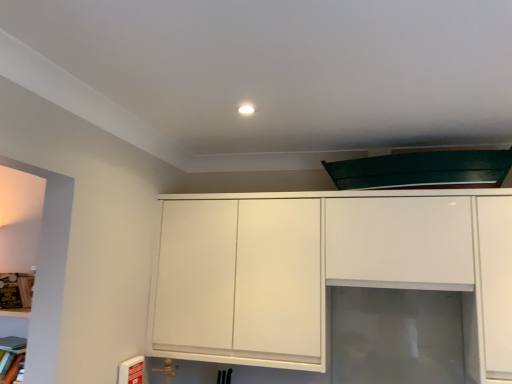
Question: Is transparent glass door at center turned away from white glossy cabinet at center?

Choices:
 (A) yes
 (B) no

Answer: (B)

Question: Can you confirm if transparent glass door at center is wider than white glossy cabinet at center?

Choices:
 (A) yes
 (B) no

Answer: (B)

Question: Is transparent glass door at center to the right of white glossy cabinet at center from the viewer's perspective?

Choices:
 (A) yes
 (B) no

Answer: (A)

Question: Is transparent glass door at center directly adjacent to white glossy cabinet at center?

Choices:
 (A) yes
 (B) no

Answer: (B)

Question: Are transparent glass door at center and white glossy cabinet at center far apart?

Choices:
 (A) no
 (B) yes

Answer: (A)

Question: Can we say transparent glass door at center lies outside white glossy cabinet at center?

Choices:
 (A) no
 (B) yes

Answer: (B)

Question: From a real-world perspective, is wooden bookshelf at left below white glossy cabinet at center?

Choices:
 (A) no
 (B) yes

Answer: (B)

Question: Does wooden bookshelf at left have a greater width compared to white glossy cabinet at center?

Choices:
 (A) yes
 (B) no

Answer: (B)

Question: Is wooden bookshelf at left oriented away from white glossy cabinet at center?

Choices:
 (A) yes
 (B) no

Answer: (B)

Question: Does wooden bookshelf at left have a lesser height compared to white glossy cabinet at center?

Choices:
 (A) yes
 (B) no

Answer: (A)

Question: Does wooden bookshelf at left have a smaller size compared to white glossy cabinet at center?

Choices:
 (A) no
 (B) yes

Answer: (B)

Question: Does wooden bookshelf at left have a greater height compared to white glossy cabinet at center?

Choices:
 (A) no
 (B) yes

Answer: (A)

Question: From the image's perspective, is white glossy cabinet at center on top of wooden bookshelf at left?

Choices:
 (A) yes
 (B) no

Answer: (A)